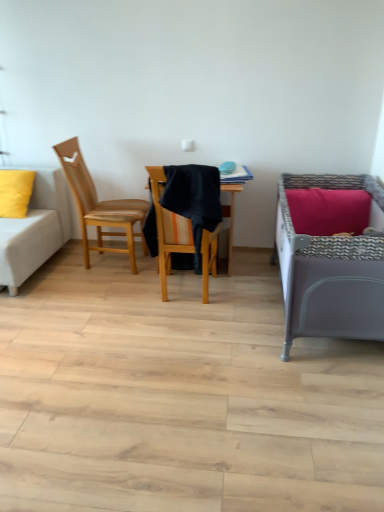
Question: Is wooden chair at left, which is counted as the 1th chair, starting from the left, positioned beyond the bounds of matte yellow pillow at left?

Choices:
 (A) yes
 (B) no

Answer: (A)

Question: Does wooden chair at left, the second chair from the right, have a greater width compared to matte yellow pillow at left?

Choices:
 (A) yes
 (B) no

Answer: (A)

Question: Is wooden chair at left, which is counted as the 1th chair, starting from the left, surrounding matte yellow pillow at left?

Choices:
 (A) yes
 (B) no

Answer: (B)

Question: From a real-world perspective, is wooden chair at left, the second chair from the right, below matte yellow pillow at left?

Choices:
 (A) no
 (B) yes

Answer: (B)

Question: Is wooden chair at left, which is counted as the 1th chair, starting from the left, to the right of matte yellow pillow at left from the viewer's perspective?

Choices:
 (A) yes
 (B) no

Answer: (A)

Question: Is wooden chair at left, which is counted as the 1th chair, starting from the left, positioned in front of matte yellow pillow at left?

Choices:
 (A) no
 (B) yes

Answer: (B)

Question: From the image's perspective, is wooden chair at left, which is counted as the 1th chair, starting from the left, below wooden chair at center, the first chair positioned from the right?

Choices:
 (A) yes
 (B) no

Answer: (B)

Question: Is wooden chair at left, the second chair from the right, in contact with wooden chair at center, which is the second chair from left to right?

Choices:
 (A) no
 (B) yes

Answer: (A)

Question: From a real-world perspective, is wooden chair at left, which is counted as the 1th chair, starting from the left, on top of wooden chair at center, the first chair positioned from the right?

Choices:
 (A) no
 (B) yes

Answer: (B)

Question: Can you confirm if wooden chair at left, the second chair from the right, is thinner than wooden chair at center, the first chair positioned from the right?

Choices:
 (A) yes
 (B) no

Answer: (B)

Question: Is wooden chair at left, the second chair from the right, turned away from wooden chair at center, the first chair positioned from the right?

Choices:
 (A) no
 (B) yes

Answer: (A)

Question: Is wooden chair at left, which is counted as the 1th chair, starting from the left, smaller than wooden chair at center, which is the second chair from left to right?

Choices:
 (A) no
 (B) yes

Answer: (A)

Question: Is matte yellow pillow at left facing away from white fabric couch at left?

Choices:
 (A) yes
 (B) no

Answer: (A)